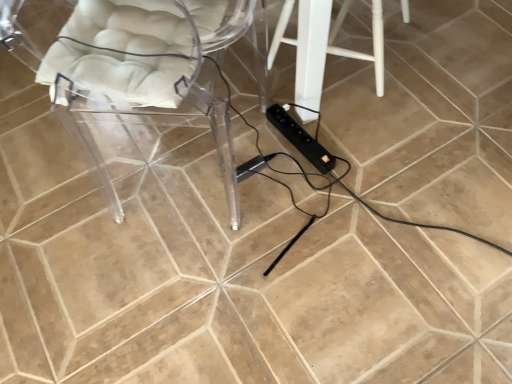
Question: Considering the relative positions of black plastic extension cord at center, the 1th extension cord in the left-to-right sequence, and transparent acrylic chair at left in the image provided, is black plastic extension cord at center, the 1th extension cord in the left-to-right sequence, to the left of transparent acrylic chair at left from the viewer's perspective?

Choices:
 (A) no
 (B) yes

Answer: (A)

Question: Is black plastic extension cord at center, the 1th extension cord in the left-to-right sequence, thinner than transparent acrylic chair at left?

Choices:
 (A) no
 (B) yes

Answer: (B)

Question: Are black plastic extension cord at center, placed as the second extension cord when sorted from right to left, and transparent acrylic chair at left located far from each other?

Choices:
 (A) yes
 (B) no

Answer: (B)

Question: Is black plastic extension cord at center, the 1th extension cord in the left-to-right sequence, taller than transparent acrylic chair at left?

Choices:
 (A) no
 (B) yes

Answer: (A)

Question: From the image's perspective, is black plastic extension cord at center, placed as the second extension cord when sorted from right to left, on top of transparent acrylic chair at left?

Choices:
 (A) no
 (B) yes

Answer: (A)

Question: Is black plastic extension cord at center, placed as the second extension cord when sorted from right to left, further to camera compared to transparent acrylic chair at left?

Choices:
 (A) yes
 (B) no

Answer: (A)

Question: Is black plastic extension cord at center, which appears as the first extension cord when viewed from the right, a part of transparent acrylic chair at left?

Choices:
 (A) no
 (B) yes

Answer: (A)

Question: Does transparent acrylic chair at left have a lesser height compared to black plastic extension cord at center, which appears as the first extension cord when viewed from the right?

Choices:
 (A) yes
 (B) no

Answer: (B)

Question: Can you confirm if transparent acrylic chair at left is thinner than black plastic extension cord at center, which appears as the first extension cord when viewed from the right?

Choices:
 (A) yes
 (B) no

Answer: (B)

Question: From the image's perspective, is transparent acrylic chair at left above black plastic extension cord at center, which appears as the first extension cord when viewed from the right?

Choices:
 (A) no
 (B) yes

Answer: (B)

Question: Can you confirm if transparent acrylic chair at left is positioned to the left of black plastic extension cord at center, the 2th extension cord from the left?

Choices:
 (A) yes
 (B) no

Answer: (A)

Question: Considering the relative positions of transparent acrylic chair at left and black plastic extension cord at center, which appears as the first extension cord when viewed from the right, in the image provided, is transparent acrylic chair at left behind black plastic extension cord at center, which appears as the first extension cord when viewed from the right,?

Choices:
 (A) no
 (B) yes

Answer: (A)

Question: Does white painted wood stool at center have a smaller size compared to transparent acrylic chair at left?

Choices:
 (A) no
 (B) yes

Answer: (B)